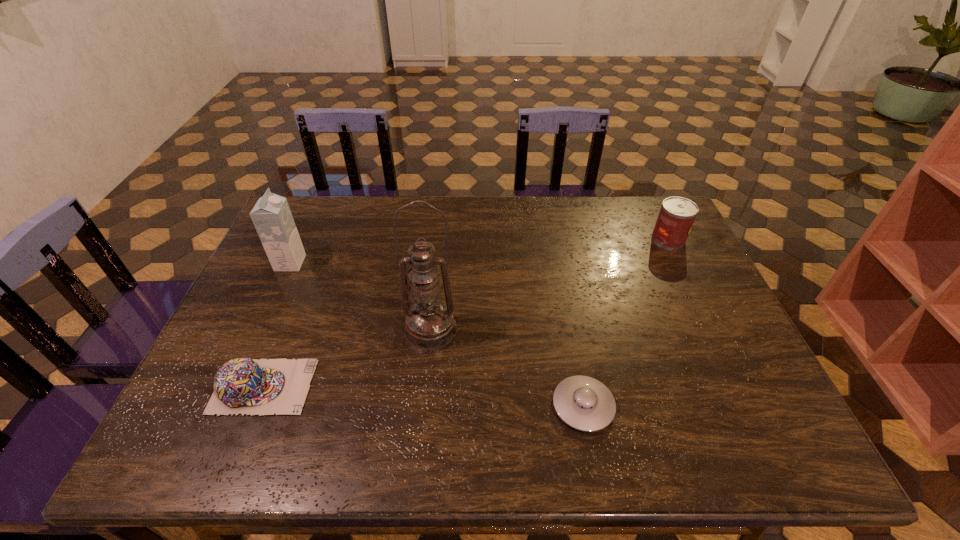
Find the location of a particular element. vacant space that satisfies the following two spatial constraints: 1. on the front side of the tallest object; 2. on the front, side, and top of the cap is located at coordinates coord(425,387).

Find the location of `free space that satisfies the following two spatial constraints: 1. on the front side of the third shortest object; 2. on the front label of the fourth nearest object`. free space that satisfies the following two spatial constraints: 1. on the front side of the third shortest object; 2. on the front label of the fourth nearest object is located at coordinates pos(681,263).

You are a GUI agent. You are given a task and a screenshot of the screen. Output one action in this format:
    pyautogui.click(x=<x>, y=<y>)
    Task: Click on the free spot that satisfies the following two spatial constraints: 1. on the front label of the second farthest object; 2. on the back side of the fourth object from left to right
    This screenshot has width=960, height=540.
    Given the screenshot: What is the action you would take?
    pyautogui.click(x=225, y=406)

You are a GUI agent. You are given a task and a screenshot of the screen. Output one action in this format:
    pyautogui.click(x=<x>, y=<y>)
    Task: Click on the vacant position in the image that satisfies the following two spatial constraints: 1. on the front side of the rightmost object; 2. on the front label of the fourth shortest object
    The width and height of the screenshot is (960, 540).
    Given the screenshot: What is the action you would take?
    pyautogui.click(x=681, y=263)